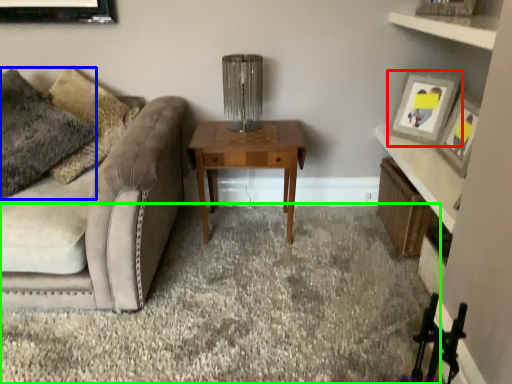
Question: Considering the real-world distances, which object is closest to picture frame (highlighted by a red box)? pillow (highlighted by a blue box) or plain (highlighted by a green box).

Choices:
 (A) pillow
 (B) plain

Answer: (B)